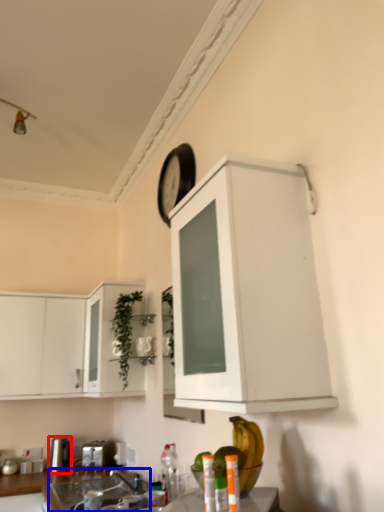
Question: Among these objects, which one is farthest to the camera, appliance (highlighted by a red box) or sink (highlighted by a blue box)?

Choices:
 (A) appliance
 (B) sink

Answer: (A)